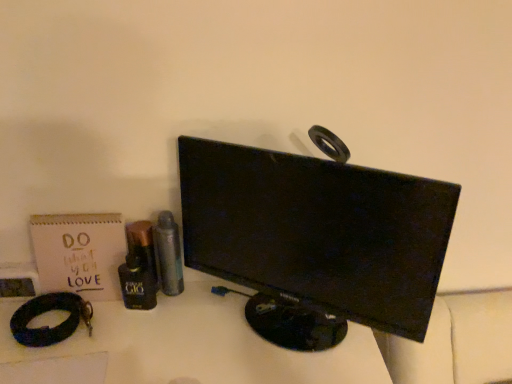
Question: Would you consider shiny black bottle at center left, the second toiletry when ordered from left to right, to be distant from black leather bracelet at lower left?

Choices:
 (A) no
 (B) yes

Answer: (A)

Question: From a real-world perspective, is shiny black bottle at center left, the second toiletry when ordered from left to right, physically above black leather bracelet at lower left?

Choices:
 (A) yes
 (B) no

Answer: (A)

Question: Considering the relative sizes of shiny black bottle at center left, the second toiletry when ordered from left to right, and black leather bracelet at lower left in the image provided, is shiny black bottle at center left, the second toiletry when ordered from left to right, shorter than black leather bracelet at lower left?

Choices:
 (A) no
 (B) yes

Answer: (A)

Question: Considering the relative sizes of shiny black bottle at center left, the 2th toiletry when ordered from right to left, and black leather bracelet at lower left in the image provided, is shiny black bottle at center left, the 2th toiletry when ordered from right to left, smaller than black leather bracelet at lower left?

Choices:
 (A) yes
 (B) no

Answer: (A)

Question: Does shiny black bottle at center left, the 2th toiletry when ordered from right to left, turn towards black leather bracelet at lower left?

Choices:
 (A) no
 (B) yes

Answer: (A)

Question: Is shiny black bottle at center left, the second toiletry when ordered from left to right, completely or partially outside of black leather bracelet at lower left?

Choices:
 (A) yes
 (B) no

Answer: (A)

Question: Considering the relative sizes of metallic silver spray can at center-left, placed as the first toiletry when sorted from right to left, and black glossy monitor at center in the image provided, is metallic silver spray can at center-left, placed as the first toiletry when sorted from right to left, wider than black glossy monitor at center?

Choices:
 (A) yes
 (B) no

Answer: (B)

Question: Is metallic silver spray can at center-left, marked as the 3th toiletry in a left-to-right arrangement, beside black glossy monitor at center?

Choices:
 (A) no
 (B) yes

Answer: (A)

Question: Considering the relative sizes of metallic silver spray can at center-left, marked as the 3th toiletry in a left-to-right arrangement, and black glossy monitor at center in the image provided, is metallic silver spray can at center-left, marked as the 3th toiletry in a left-to-right arrangement, taller than black glossy monitor at center?

Choices:
 (A) yes
 (B) no

Answer: (B)

Question: From a real-world perspective, is metallic silver spray can at center-left, placed as the first toiletry when sorted from right to left, beneath black glossy monitor at center?

Choices:
 (A) yes
 (B) no

Answer: (A)

Question: Is metallic silver spray can at center-left, marked as the 3th toiletry in a left-to-right arrangement, shorter than black glossy monitor at center?

Choices:
 (A) no
 (B) yes

Answer: (B)

Question: From a real-world perspective, is metallic silver spray can at center-left, placed as the first toiletry when sorted from right to left, physically above black glossy monitor at center?

Choices:
 (A) no
 (B) yes

Answer: (A)

Question: Considering the relative sizes of matte paper notebook at left and black leather bracelet at lower left in the image provided, is matte paper notebook at left smaller than black leather bracelet at lower left?

Choices:
 (A) no
 (B) yes

Answer: (A)